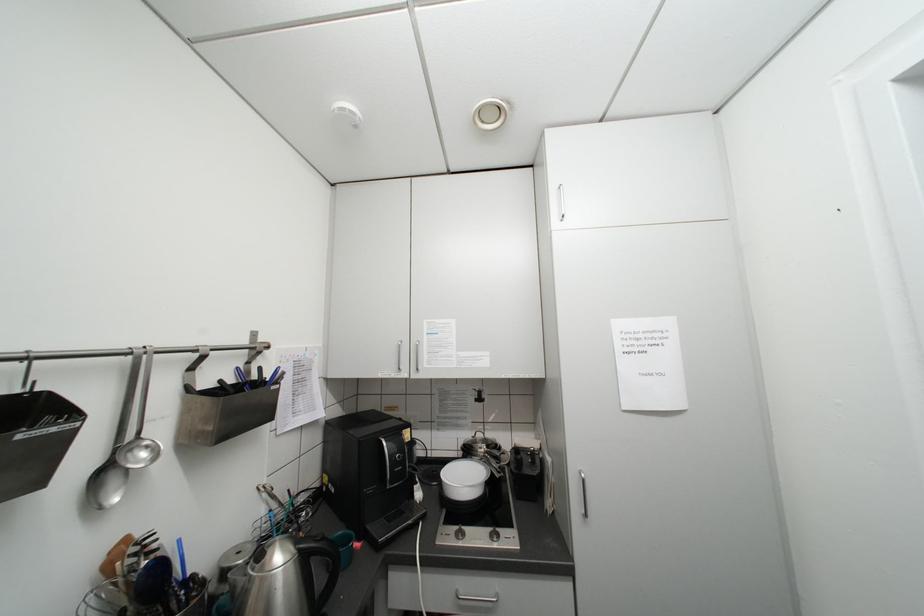
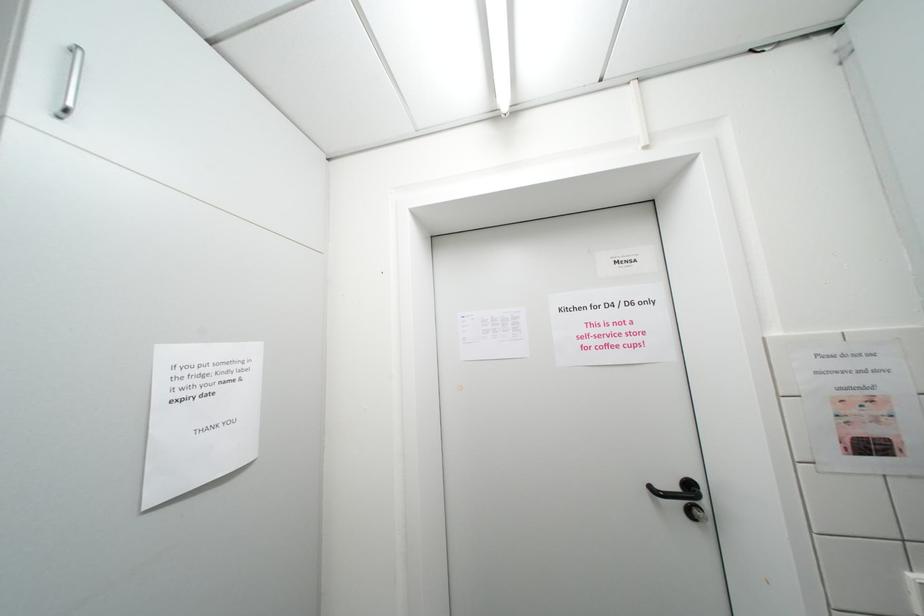
Question: The images are taken continuously from a first-person perspective. In which direction is your viewpoint rotating?

Choices:
 (A) Left
 (B) Right
 (C) Up
 (D) Down

Answer: (B)